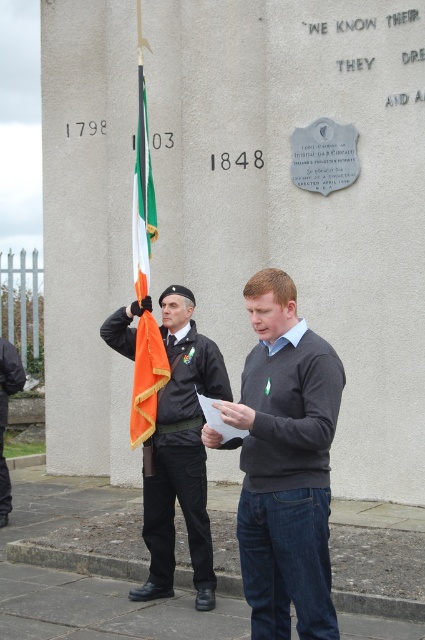
Does dark gray sweater at center have a smaller size compared to dark gray uniform at center?

No.

Is dark gray sweater at center closer to camera compared to dark gray uniform at center?

That is True.

Is point (246, 582) positioned behind point (23, 371)?

No.

You are a GUI agent. You are given a task and a screenshot of the screen. Output one action in this format:
    pyautogui.click(x=<x>, y=<y>)
    Task: Click on the dark gray sweater at center
    The width and height of the screenshot is (425, 640).
    Given the screenshot: What is the action you would take?
    pyautogui.click(x=286, y=464)

Who is positioned more to the left, orange fabric flag at center or dark gray uniform at center?

dark gray uniform at center

Looking at this image, can you confirm if orange fabric flag at center is positioned below dark gray uniform at center?

No, orange fabric flag at center is not below dark gray uniform at center.

What do you see at coordinates (147, 378) in the screenshot? I see `orange fabric flag at center` at bounding box center [147, 378].

Where is `orange fabric flag at center`? orange fabric flag at center is located at coordinates (147, 378).

Is point (280, 451) closer to viewer compared to point (138, 269)?

Yes, it is in front of point (138, 269).

From the picture: Which is below, dark gray sweater at center or irish flag at center?

Positioned lower is dark gray sweater at center.

Locate an element on the screen. Image resolution: width=425 pixels, height=640 pixels. dark gray sweater at center is located at coordinates (286, 464).